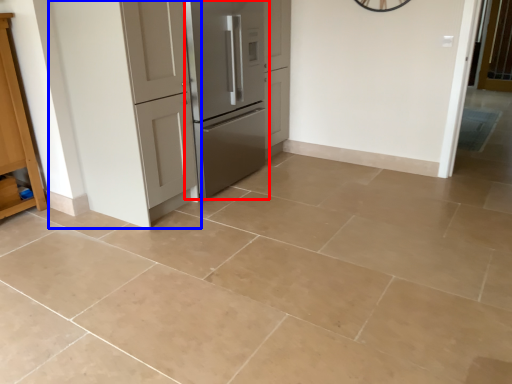
Question: Which object is further to the camera taking this photo, refrigerator (highlighted by a red box) or door (highlighted by a blue box)?

Choices:
 (A) refrigerator
 (B) door

Answer: (A)